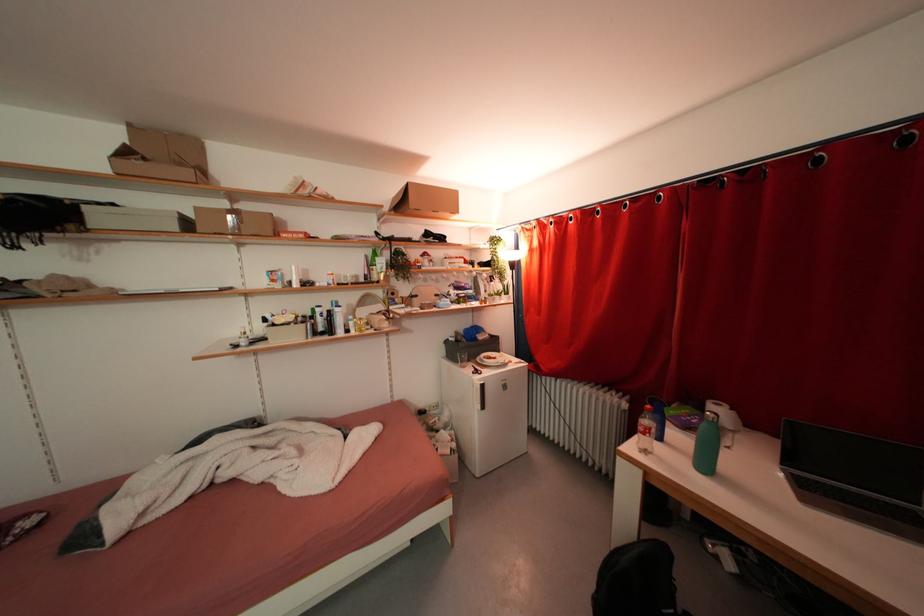
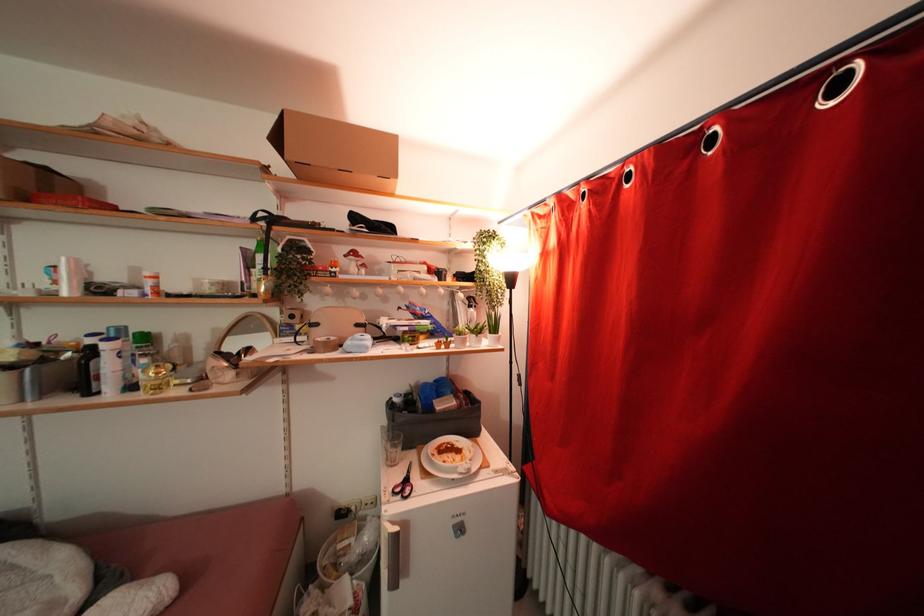
In the second image, find the point that corresponds to (454,219) in the first image.

(381, 184)